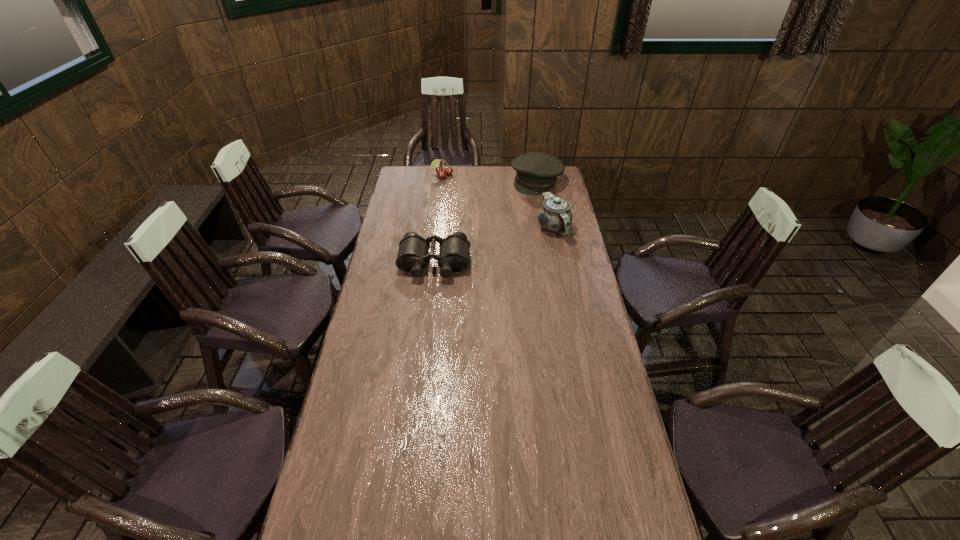
Locate an element on the screen. The width and height of the screenshot is (960, 540). binoculars is located at coordinates (412, 256).

Where is `chinaware`? The image size is (960, 540). chinaware is located at coordinates (555, 215).

This screenshot has height=540, width=960. I want to click on the tallest object, so click(555, 215).

This screenshot has width=960, height=540. In order to click on cherry in this screenshot , I will do `click(441, 172)`.

Identify the location of beret. The height and width of the screenshot is (540, 960). (537, 173).

This screenshot has width=960, height=540. Find the location of `blank space located through the eyepieces of the binoculars`. blank space located through the eyepieces of the binoculars is located at coordinates pyautogui.click(x=428, y=315).

Locate an element on the screen. Image resolution: width=960 pixels, height=540 pixels. vacant space located 0.160m from the spout of the chinaware is located at coordinates (562, 267).

At what (x,y) coordinates should I click in order to perform the action: click on vacant space located on the leaves of the cherry. Please return your answer as a coordinate pair (x, y). Looking at the image, I should click on (451, 190).

Find the location of a particular element. The image size is (960, 540). vacant area situated on the leaves of the cherry is located at coordinates (457, 199).

Where is `vacant region located on the leaves of the cherry`? The height and width of the screenshot is (540, 960). vacant region located on the leaves of the cherry is located at coordinates (464, 210).